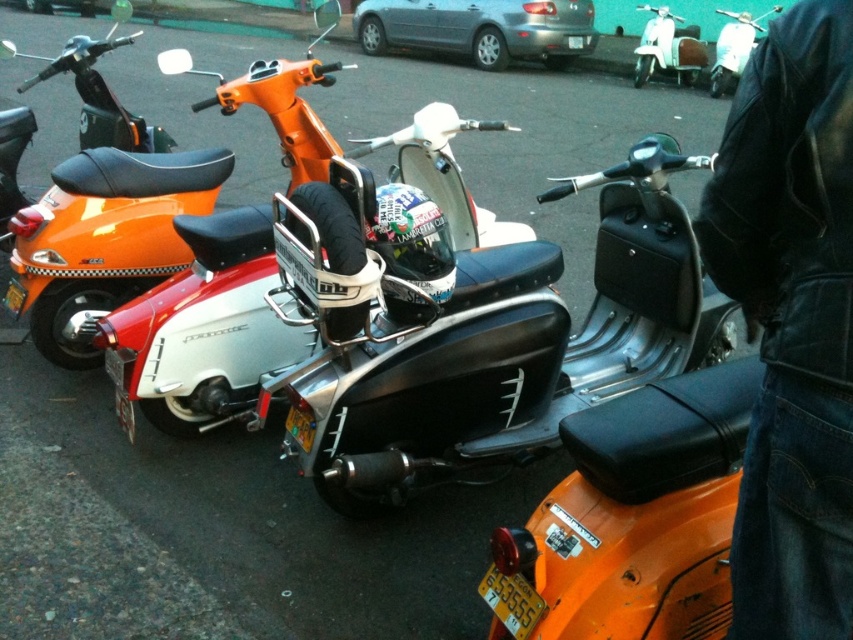
Question: Among these points, which one is farthest from the camera?

Choices:
 (A) (213, 264)
 (B) (550, 602)
 (C) (611, 275)
 (D) (123, 417)

Answer: (C)

Question: Can you confirm if orange matte scooter at center is positioned above matte orange scooter at upper right?

Choices:
 (A) no
 (B) yes

Answer: (A)

Question: Which of the following is the farthest from the observer?

Choices:
 (A) (723, 92)
 (B) (132, 440)

Answer: (A)

Question: Based on their relative distances, which object is farther from the yellow metallic license plate at center?

Choices:
 (A) metallic silver scooter at center
 (B) silver metallic scooter at center

Answer: (A)

Question: Is metallic silver scooter at center positioned before orange matte scooter at center?

Choices:
 (A) yes
 (B) no

Answer: (B)

Question: Where is metallic silver scooter at upper center located in relation to yellow metallic license plate at lower center in the image?

Choices:
 (A) left
 (B) right

Answer: (B)